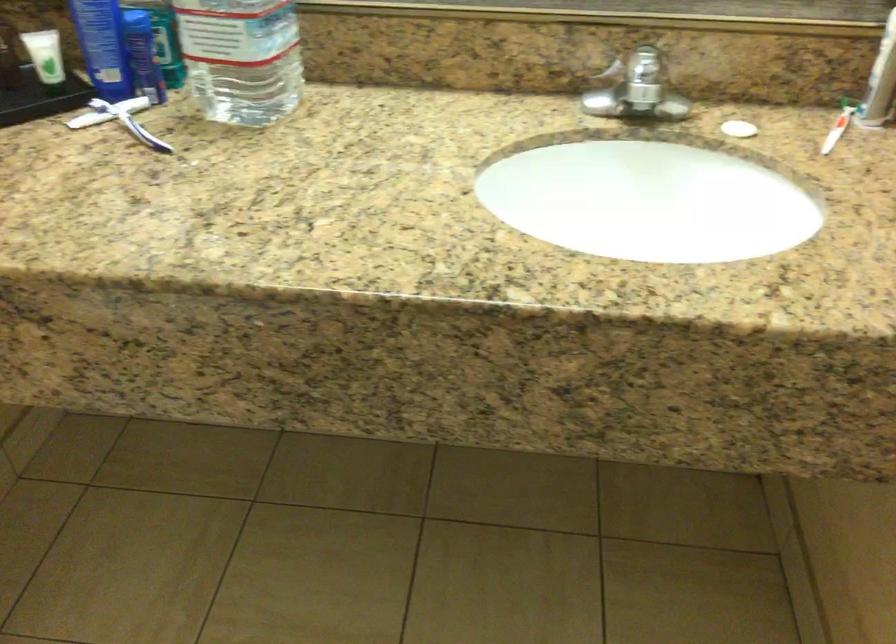
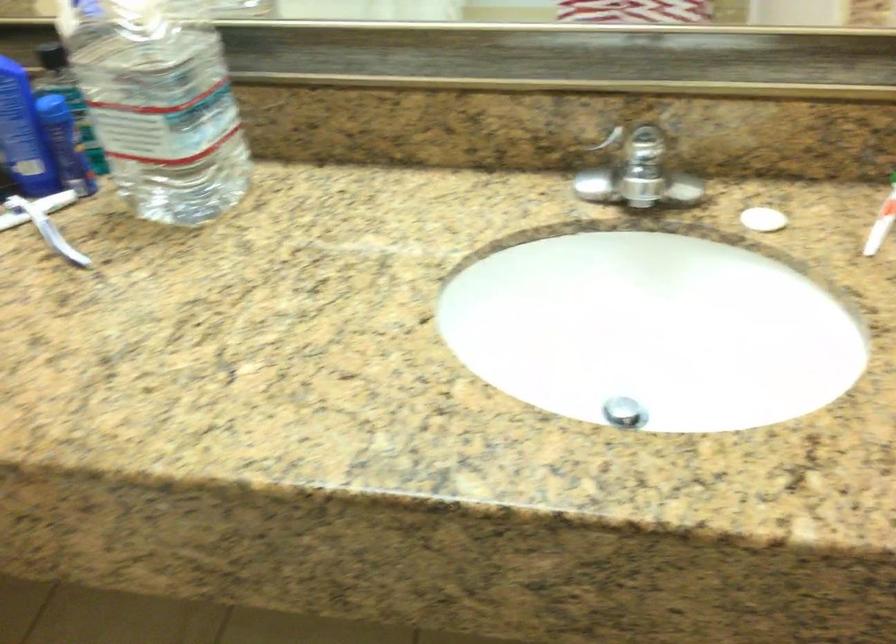
Locate, in the second image, the point that corresponds to [599,69] in the first image.

(599, 144)